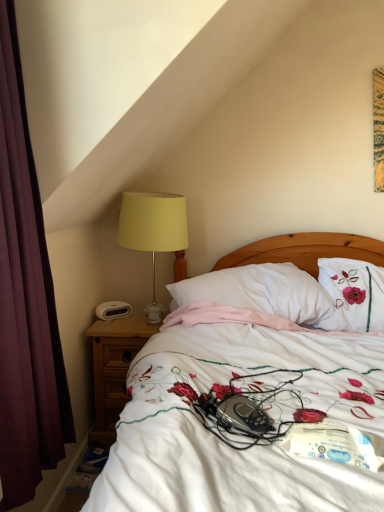
Where is `free space in front of white plastic alarm clock at left`? free space in front of white plastic alarm clock at left is located at coordinates (107, 325).